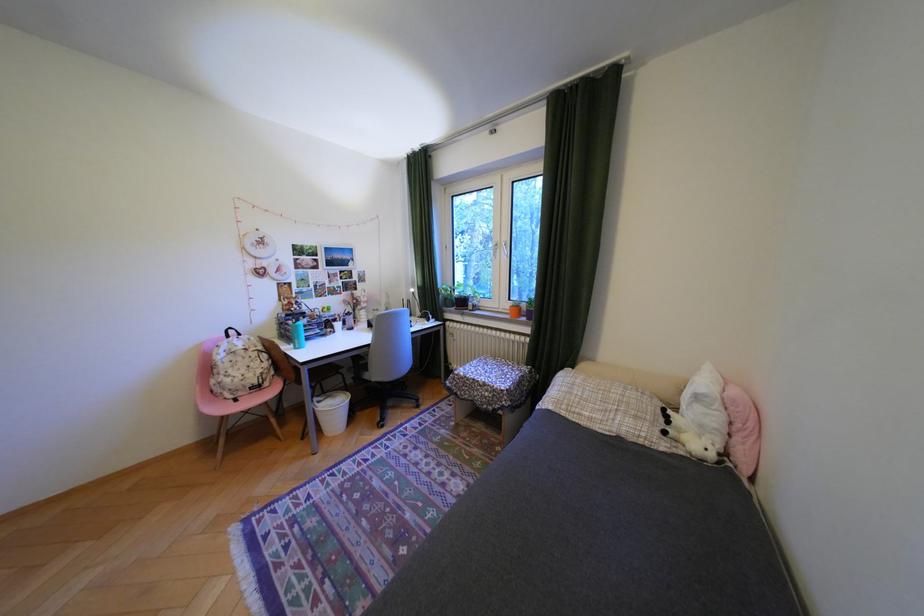
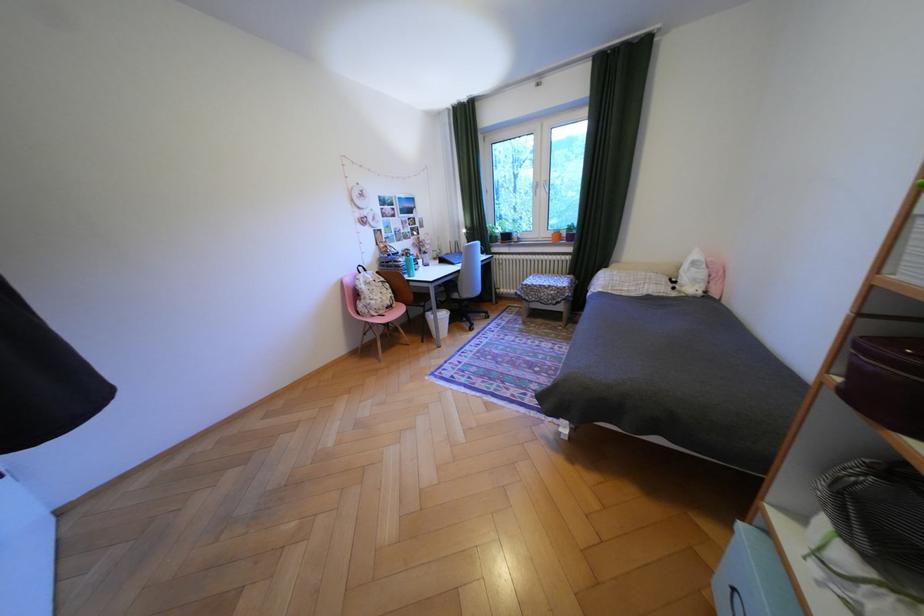
Where in the second image is the point corresponding to [251,359] from the first image?

(386, 288)